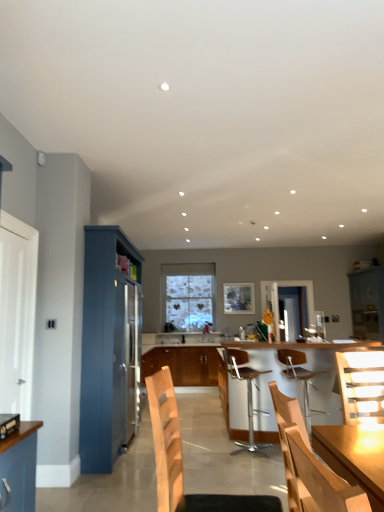
Question: Is wooden cabinet at center, marked as the third cabinetry in a front-to-back arrangement, not within metallic silver bar stool at center, the 4th chair when ordered from front to back?

Choices:
 (A) no
 (B) yes

Answer: (B)

Question: Is wooden cabinet at center, marked as the third cabinetry in a front-to-back arrangement, oriented away from metallic silver bar stool at center, the 4th chair when ordered from front to back?

Choices:
 (A) yes
 (B) no

Answer: (B)

Question: Is wooden cabinet at center, the first cabinetry viewed from the back, smaller than metallic silver bar stool at center, acting as the 2th chair starting from the back?

Choices:
 (A) yes
 (B) no

Answer: (B)

Question: Is wooden cabinet at center, the first cabinetry viewed from the back, shorter than metallic silver bar stool at center, the 4th chair when ordered from front to back?

Choices:
 (A) yes
 (B) no

Answer: (A)

Question: Is metallic silver bar stool at center, the 4th chair when ordered from front to back, completely or partially inside wooden cabinet at center, the 2th cabinetry viewed from the right?

Choices:
 (A) no
 (B) yes

Answer: (A)

Question: Based on their sizes in the image, would you say white textured stone window at center is bigger or smaller than wooden chair at center, which is counted as the 2th chair, starting from the front?

Choices:
 (A) small
 (B) big

Answer: (B)

Question: Considering the relative positions of white textured stone window at center and wooden chair at center, which is counted as the 2th chair, starting from the front, in the image provided, is white textured stone window at center to the left or to the right of wooden chair at center, which is counted as the 2th chair, starting from the front,?

Choices:
 (A) left
 (B) right

Answer: (A)

Question: From a real-world perspective, is white textured stone window at center above or below wooden chair at center, which is the 4th chair from back to front?

Choices:
 (A) above
 (B) below

Answer: (A)

Question: In terms of height, does white textured stone window at center look taller or shorter compared to wooden chair at center, which is counted as the 2th chair, starting from the front?

Choices:
 (A) short
 (B) tall

Answer: (B)

Question: Is point (352, 308) positioned closer to the camera than point (236, 301)?

Choices:
 (A) farther
 (B) closer

Answer: (B)

Question: In the image, is matte blue cabinet at right, which ranks as the 3th cabinetry in left-to-right order, positioned in front of or behind glass window screen at center?

Choices:
 (A) front
 (B) behind

Answer: (A)

Question: Based on their positions, is matte blue cabinet at right, the 2th cabinetry in the front-to-back sequence, located to the left or right of glass window screen at center?

Choices:
 (A) right
 (B) left

Answer: (A)

Question: Which is correct: matte blue cabinet at right, the 2th cabinetry in the front-to-back sequence, is inside glass window screen at center, or outside of it?

Choices:
 (A) outside
 (B) inside

Answer: (A)

Question: Considering the positions of brushed metal toaster at left and wooden chair at center, placed as the 1th chair when sorted from front to back, in the image, is brushed metal toaster at left taller or shorter than wooden chair at center, placed as the 1th chair when sorted from front to back,?

Choices:
 (A) tall
 (B) short

Answer: (B)

Question: From the image's perspective, relative to wooden chair at center, the fifth chair from the back, is brushed metal toaster at left above or below?

Choices:
 (A) above
 (B) below

Answer: (B)